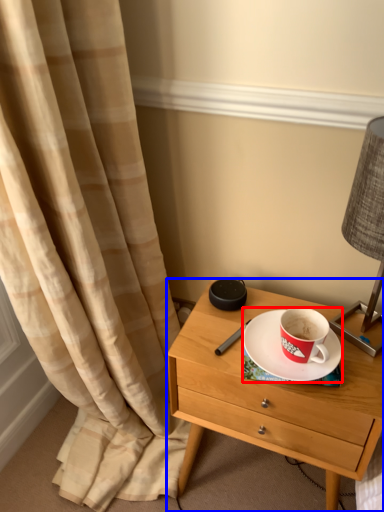
Question: Which of the following is the closest to the observer, saucer (highlighted by a red box) or nightstand (highlighted by a blue box)?

Choices:
 (A) saucer
 (B) nightstand

Answer: (B)